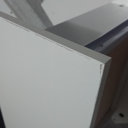
Identify the location of surface. (95, 33).